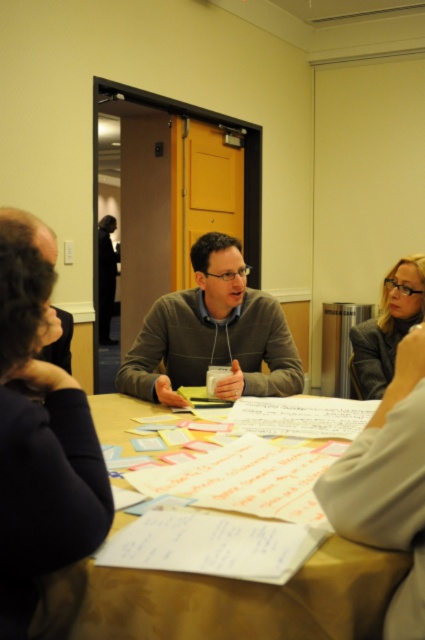
Between point (397, 560) and point (388, 380), which one is positioned behind?

Positioned behind is point (388, 380).

What do you see at coordinates (223, 600) in the screenshot? This screenshot has width=425, height=640. I see `brown paper table at center` at bounding box center [223, 600].

Is point (229, 637) closer to viewer compared to point (387, 314)?

Yes, point (229, 637) is in front of point (387, 314).

Locate an element on the screen. brown paper table at center is located at coordinates (223, 600).

From the picture: Does matte gray sweater at center come behind dark brown hair at upper left?

Yes, matte gray sweater at center is behind dark brown hair at upper left.

Between matte gray sweater at center and dark brown hair at upper left, which one is positioned lower?

Positioned lower is dark brown hair at upper left.

Does point (266, 307) come closer to viewer compared to point (31, 220)?

No.

This screenshot has width=425, height=640. Identify the location of matte gray sweater at center. (212, 333).

Does matte gray sweater at center have a smaller size compared to matte gray blazer at upper right?

No.

Is point (269, 330) farther from camera compared to point (394, 324)?

No, it is not.

Is point (203, 300) positioned behind point (387, 378)?

No, (203, 300) is closer to viewer.

The width and height of the screenshot is (425, 640). In order to click on matte gray sweater at center in this screenshot , I will do `click(212, 333)`.